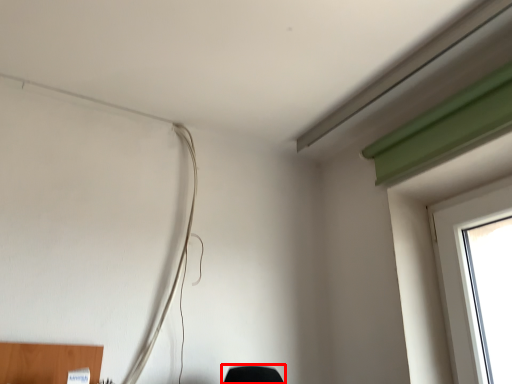
Question: Where is furniture (annotated by the red box) located in relation to wire in the image?

Choices:
 (A) right
 (B) left

Answer: (A)